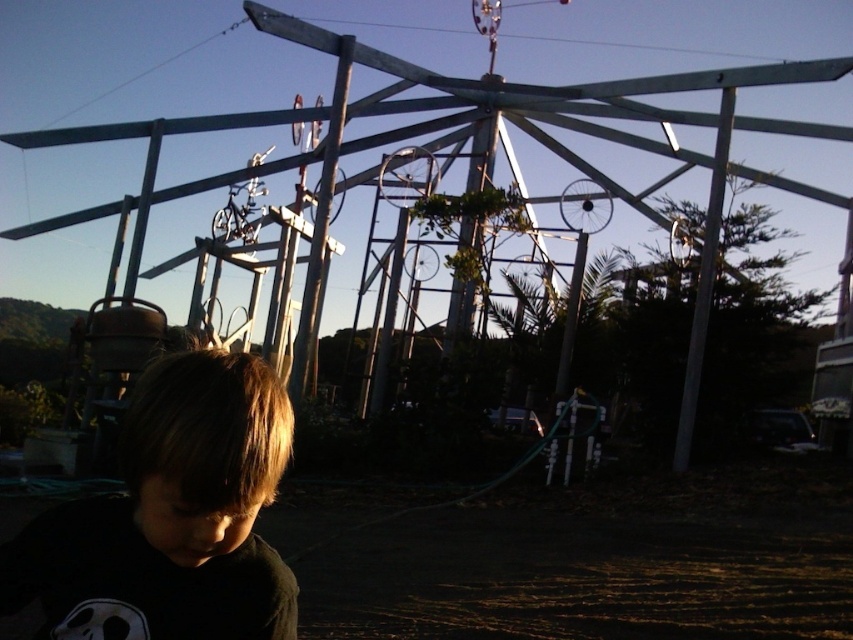
What is the exact location of the dark brown hair at lower left in the image?

The dark brown hair at lower left is located at point coordinates of (171, 516).

You are a painter who wants to paint both the metallic silver pole at center and the white matte pole at right. Which pole will require more paint to cover its entire surface area?

The metallic silver pole at center requires more paint because it is much taller than the white matte pole at right, meaning it has a larger surface area to cover.

You are standing in front of the playground structure and want to take a photo of the metallic silver pole at center without including the bicycle wheels. Is the distance sufficient to frame the pole alone?

The metallic silver pole at center is 8.32 meters away from camera, so if your camera has a sufficient zoom or you can move closer, you can frame it without the bicycle wheels. However, at this distance, the pole might be small in the frame unless zoomed in.